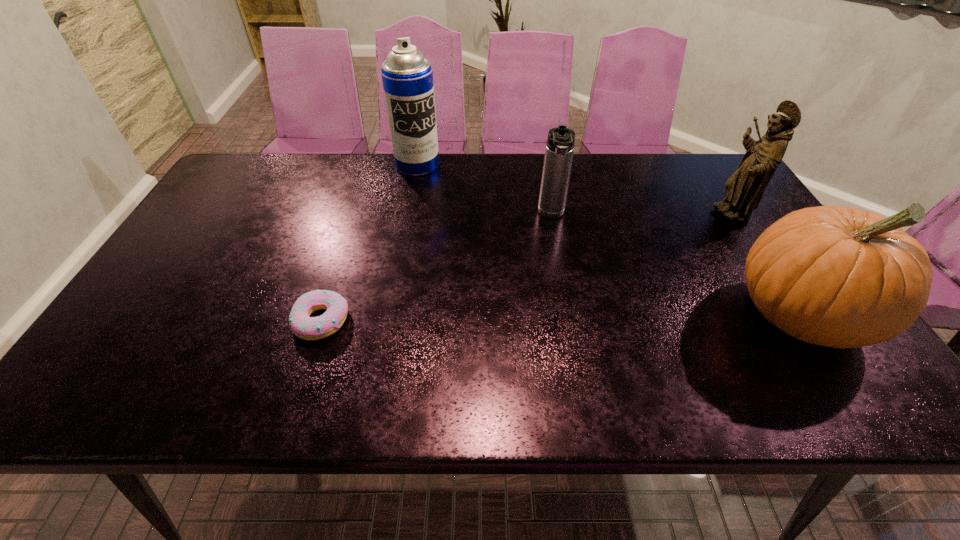
What are the coordinates of `pumpkin located at the near edge` in the screenshot? It's located at (842, 277).

Where is `pumpkin that is at the right edge`? The image size is (960, 540). pumpkin that is at the right edge is located at coordinates (842, 277).

Identify the location of figurine that is at the right edge. (743, 191).

This screenshot has height=540, width=960. Find the location of `object present at the near right corner`. object present at the near right corner is located at coordinates (842, 277).

Where is `vacant space at the far edge`? vacant space at the far edge is located at coordinates (486, 154).

What are the coordinates of `free space at the near edge of the desktop` in the screenshot? It's located at (347, 357).

The width and height of the screenshot is (960, 540). I want to click on free space at the left edge of the desktop, so click(x=180, y=253).

Where is `vacant space at the right edge of the desktop`? vacant space at the right edge of the desktop is located at coordinates (716, 233).

Image resolution: width=960 pixels, height=540 pixels. Identify the location of free region at the far right corner of the desktop. (714, 190).

Image resolution: width=960 pixels, height=540 pixels. I want to click on vacant region between the tallest object and the third object from right to left, so click(x=485, y=190).